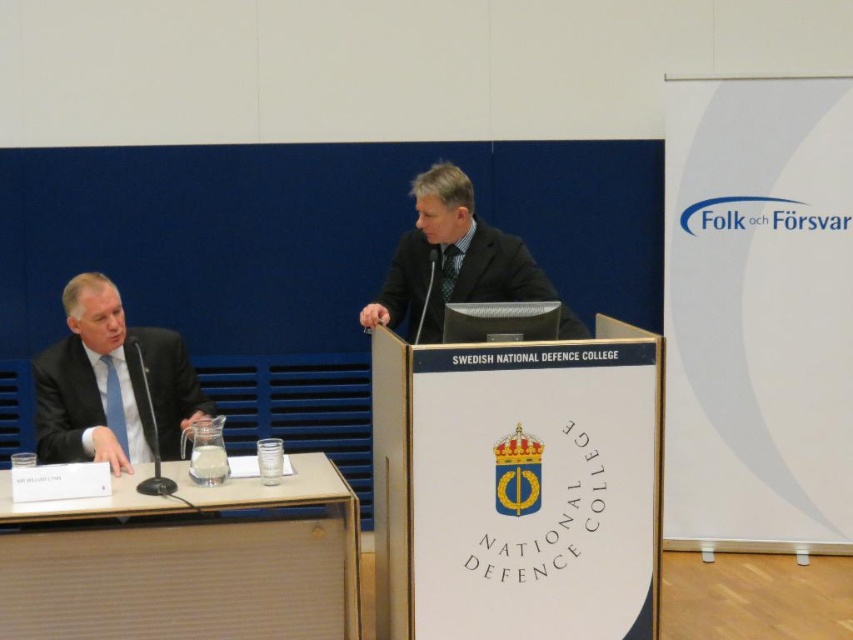
Which is more to the left, light brown wood table at lower left or dark gray suit at center?

From the viewer's perspective, light brown wood table at lower left appears more on the left side.

Is light brown wood table at lower left smaller than dark gray suit at center?

Incorrect, light brown wood table at lower left is not smaller in size than dark gray suit at center.

Between point (207, 515) and point (483, 291), which one is positioned in front?

Positioned in front is point (207, 515).

You are a GUI agent. You are given a task and a screenshot of the screen. Output one action in this format:
    pyautogui.click(x=<x>, y=<y>)
    Task: Click on the light brown wood table at lower left
    
    Given the screenshot: What is the action you would take?
    pyautogui.click(x=184, y=561)

Is light brown wood table at lower left positioned behind matte black suit at left?

That is False.

Who is lower down, light brown wood table at lower left or matte black suit at left?

light brown wood table at lower left is below.

Is point (149, 468) positioned after point (196, 390)?

No, it is not.

Where is `light brown wood table at lower left`? The image size is (853, 640). light brown wood table at lower left is located at coordinates (184, 561).

Which is in front, point (184, 424) or point (445, 186)?

Point (445, 186)

Describe the element at coordinates (111, 385) in the screenshot. I see `matte black suit at left` at that location.

At what (x,y) coordinates should I click in order to perform the action: click on matte black suit at left. Please return your answer as a coordinate pair (x, y). Image resolution: width=853 pixels, height=640 pixels. Looking at the image, I should click on (111, 385).